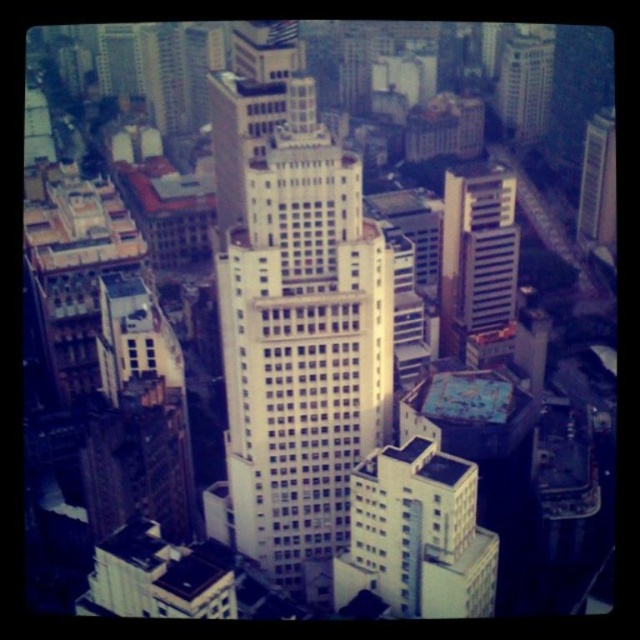
You are a drone operator flying a drone over the urban landscape. You need to determine if the point at coordinate point [448,252] is closer to the camera than the point at coordinate point [616,221]. Can you confirm this based on the aerial view?

Yes, the point at coordinate point [448,252] is closer to the camera than the point at coordinate point [616,221] according to the aerial view.

You are a drone operator flying over the city. You need to deliver a package to the metallic glass skyscraper at upper right but must avoid flying over the white glossy building at upper right. Can you do this while staying within the same general area?

The metallic glass skyscraper at upper right is behind the white glossy building at upper right, so you can fly behind the white glossy building at upper right to reach the metallic glass skyscraper at upper right without flying over it.

You are a drone operator trying to locate a specific point in an urban area. You have a point at coordinates (x=525, y=81). Based on the scene description, can you determine which building this point is located on?

The point at coordinates (x=525, y=81) is located on the white glossy building at upper right.